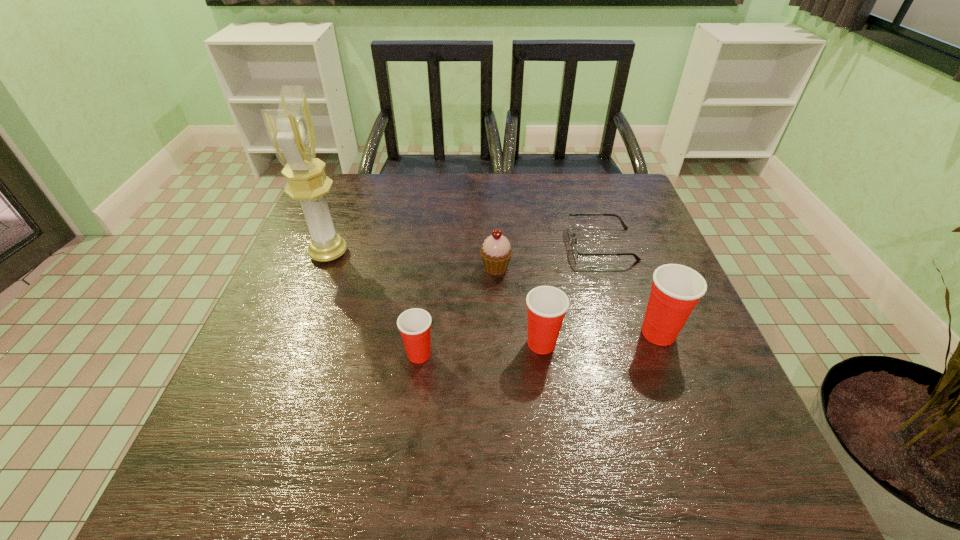
Where is `vacant space that satisfies the following two spatial constraints: 1. on the front-facing side of the second tallest object; 2. on the left side of the spectacles`? vacant space that satisfies the following two spatial constraints: 1. on the front-facing side of the second tallest object; 2. on the left side of the spectacles is located at coordinates (630, 333).

You are a GUI agent. You are given a task and a screenshot of the screen. Output one action in this format:
    pyautogui.click(x=<x>, y=<y>)
    Task: Click on the free space that satisfies the following two spatial constraints: 1. on the front-facing side of the leftmost object; 2. on the back side of the second Dixie cup from right to left
    This screenshot has height=540, width=960.
    Given the screenshot: What is the action you would take?
    pyautogui.click(x=294, y=343)

I want to click on free space that satisfies the following two spatial constraints: 1. on the back side of the tallest Dixie cup; 2. on the right side of the leftmost Dixie cup, so click(421, 333).

Locate an element on the screen. The width and height of the screenshot is (960, 540). blank space that satisfies the following two spatial constraints: 1. on the front-facing side of the award; 2. on the left side of the fourth object from right to left is located at coordinates (324, 267).

The image size is (960, 540). In order to click on free space that satisfies the following two spatial constraints: 1. on the front-facing side of the award; 2. on the left side of the second Dixie cup from left to right in this screenshot , I will do `click(294, 343)`.

Where is `vacant space that satisfies the following two spatial constraints: 1. on the front-facing side of the cupcake; 2. on the left side of the tallest object`? vacant space that satisfies the following two spatial constraints: 1. on the front-facing side of the cupcake; 2. on the left side of the tallest object is located at coordinates coord(324,267).

Where is `vacant region that satisfies the following two spatial constraints: 1. on the front-facing side of the rightmost Dixie cup; 2. on the right side of the spectacles`? The height and width of the screenshot is (540, 960). vacant region that satisfies the following two spatial constraints: 1. on the front-facing side of the rightmost Dixie cup; 2. on the right side of the spectacles is located at coordinates (630, 333).